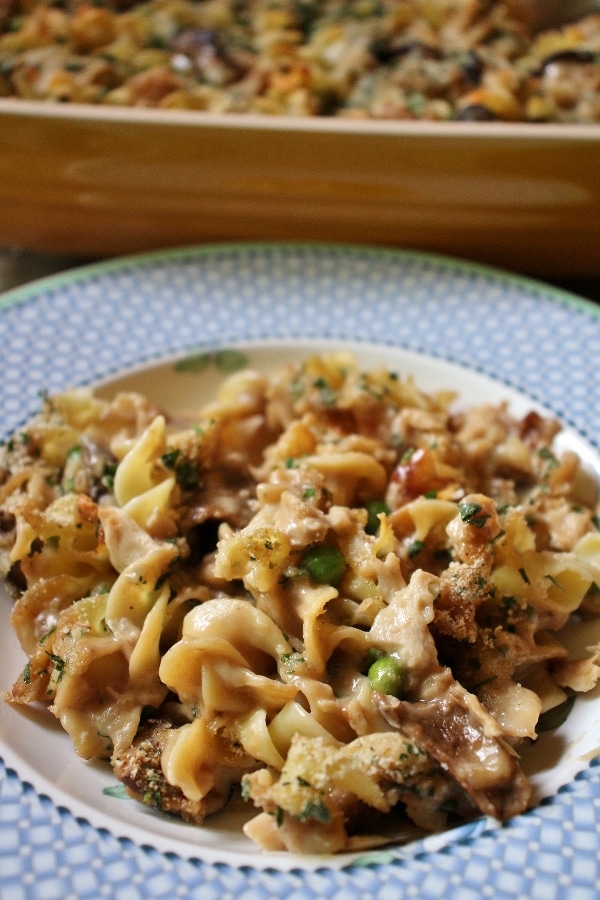
You are a GUI agent. You are given a task and a screenshot of the screen. Output one action in this format:
    pyautogui.click(x=<x>, y=<y>)
    Task: Click on the food spilling over bowl area
    The width and height of the screenshot is (600, 900).
    Given the screenshot: What is the action you would take?
    pyautogui.click(x=500, y=820), pyautogui.click(x=70, y=398), pyautogui.click(x=10, y=487)